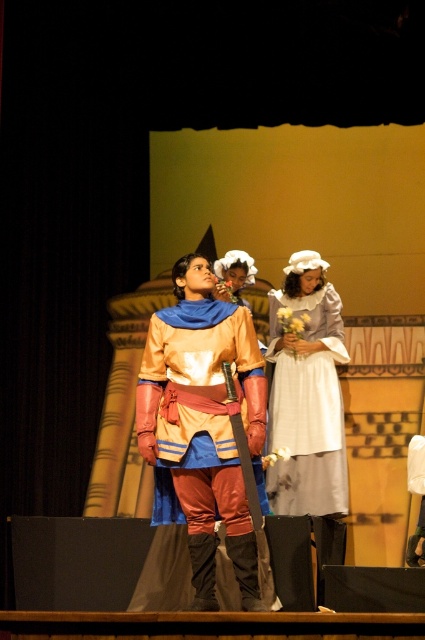
Question: Is matte gold armor at center wider than white cotton dress at center?

Choices:
 (A) no
 (B) yes

Answer: (B)

Question: Is matte gold armor at center smaller than white cotton dress at center?

Choices:
 (A) yes
 (B) no

Answer: (A)

Question: Which of the following is the farthest from the observer?

Choices:
 (A) (325, 356)
 (B) (187, 449)

Answer: (A)

Question: Which of the following is the farthest from the observer?

Choices:
 (A) matte gold armor at center
 (B) white cotton dress at center

Answer: (B)

Question: Among these objects, which one is farthest from the camera?

Choices:
 (A) matte gold armor at center
 (B) white cotton dress at center

Answer: (B)

Question: Is matte gold armor at center positioned behind white cotton dress at center?

Choices:
 (A) no
 (B) yes

Answer: (A)